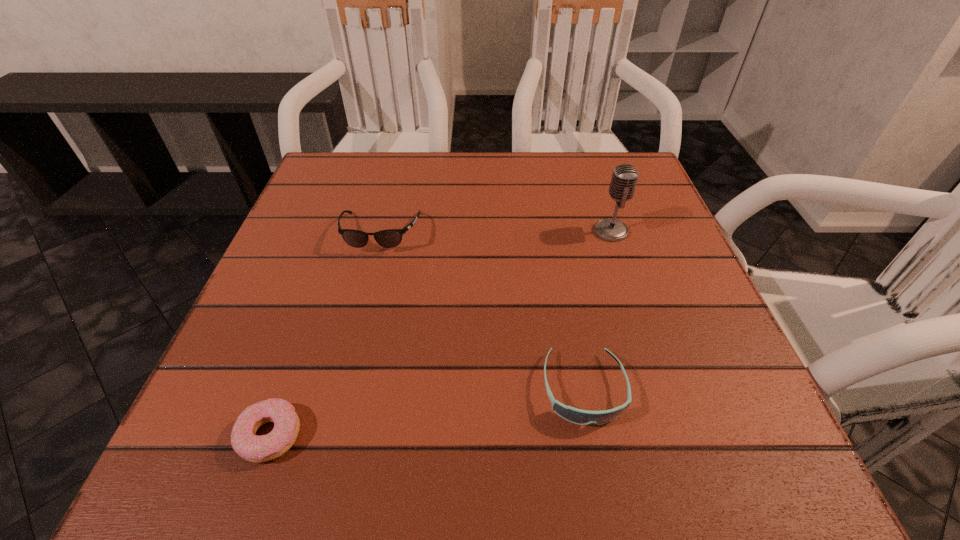
The width and height of the screenshot is (960, 540). In order to click on doughnut positioned at the near edge in this screenshot , I will do `click(253, 448)`.

At what (x,y) coordinates should I click in order to perform the action: click on sunglasses that is at the left edge. Please return your answer as a coordinate pair (x, y). Looking at the image, I should click on (389, 238).

This screenshot has width=960, height=540. In order to click on doughnut that is at the left edge in this screenshot , I will do `click(253, 448)`.

I want to click on object located at the right edge, so [624, 179].

Where is `object located in the near left corner section of the desktop`? This screenshot has width=960, height=540. object located in the near left corner section of the desktop is located at coordinates click(x=253, y=448).

Identify the location of free spot at the far edge of the desktop. (386, 205).

The width and height of the screenshot is (960, 540). In the image, there is a desktop. What are the coordinates of `vacant space at the left edge` in the screenshot? It's located at (245, 408).

In the image, there is a desktop. What are the coordinates of `vacant area at the right edge` in the screenshot? It's located at (620, 248).

At what (x,y) coordinates should I click in order to perform the action: click on free space at the far left corner of the desktop. Please return your answer as a coordinate pair (x, y). This screenshot has width=960, height=540. Looking at the image, I should click on (340, 171).

Find the location of `vacant space at the near left corner`. vacant space at the near left corner is located at coordinates (218, 426).